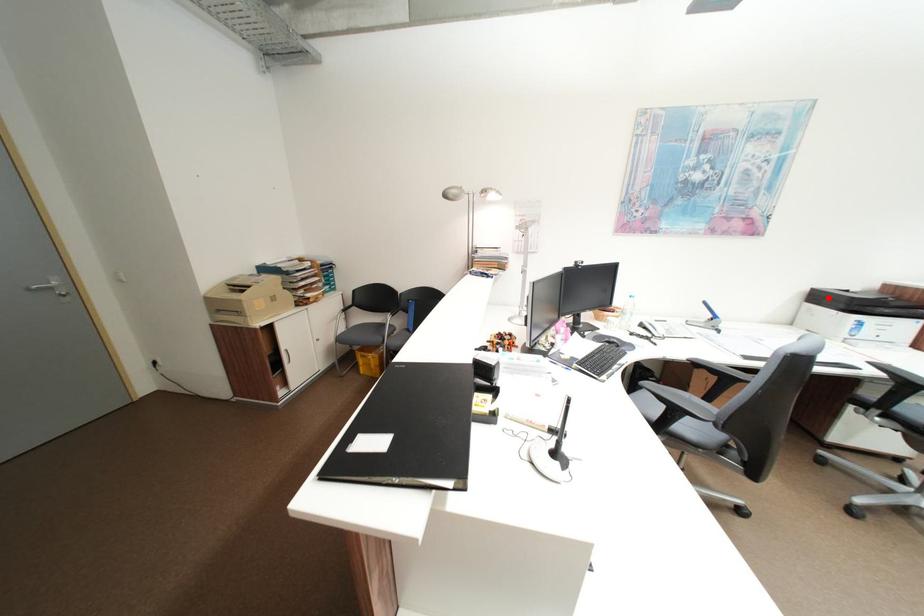
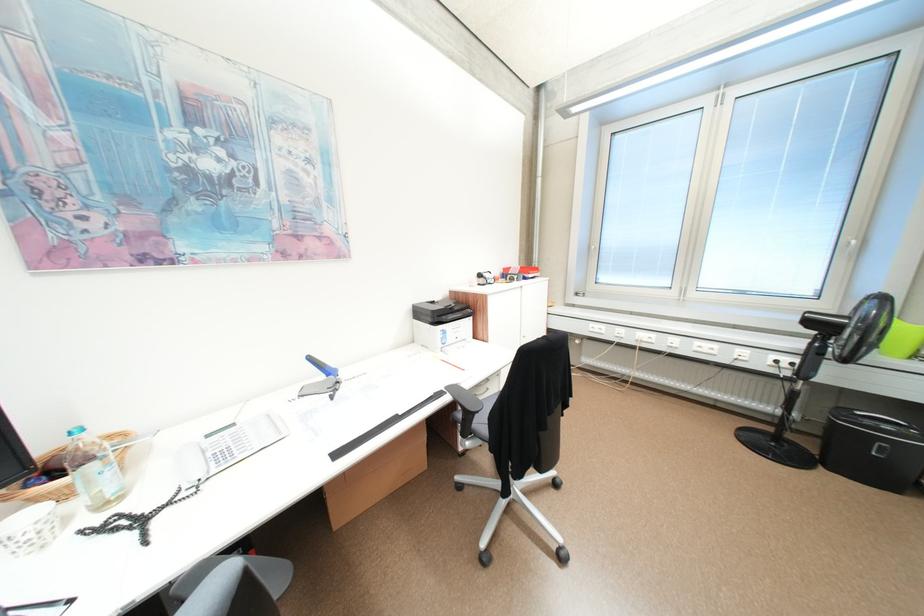
Where in the second image is the point corresponding to the highlighted location from the first image?

(428, 313)